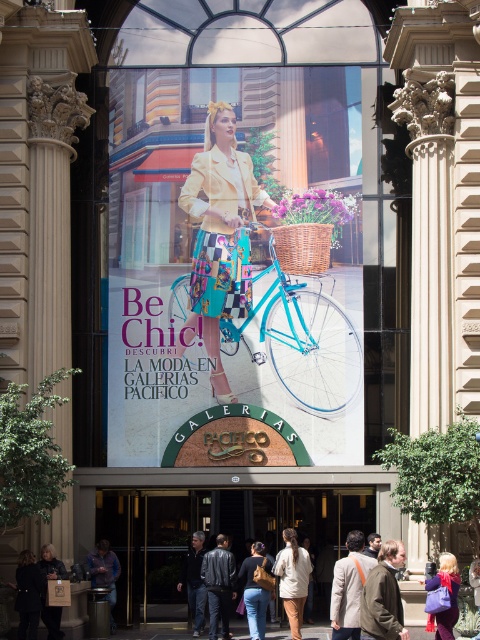
Which is in front, point (367, 620) or point (284, 244)?

Point (367, 620) is more forward.

Where is `brown leather jacket at lower center`? brown leather jacket at lower center is located at coordinates (384, 596).

Locate an element on the screen. brown leather jacket at lower center is located at coordinates (384, 596).

Does matte black backpack at center have a greater width compared to purple fabric bag at lower right?

Indeed, matte black backpack at center has a greater width compared to purple fabric bag at lower right.

Is matte black backpack at center behind purple fabric bag at lower right?

Yes, matte black backpack at center is behind purple fabric bag at lower right.

Between point (261, 605) and point (444, 621), which one is positioned behind?

Point (261, 605)

Locate an element on the screen. matte black backpack at center is located at coordinates (255, 589).

Between teal metallic bicycle at center and matte beige jacket at center, which one appears on the right side from the viewer's perspective?

matte beige jacket at center is more to the right.

Is point (264, 323) positioned in front of point (351, 609)?

No, (264, 323) is further to viewer.

The width and height of the screenshot is (480, 640). What do you see at coordinates (302, 342) in the screenshot?
I see `teal metallic bicycle at center` at bounding box center [302, 342].

The height and width of the screenshot is (640, 480). In order to click on teal metallic bicycle at center in this screenshot , I will do `click(302, 342)`.